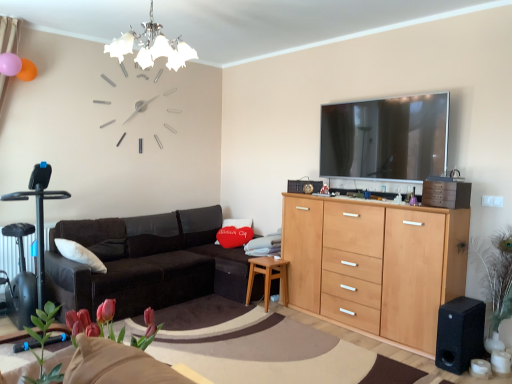
Question: Is black plastic swivel chair at left wider than light brown wooden side table at lower center?

Choices:
 (A) yes
 (B) no

Answer: (A)

Question: Is black plastic swivel chair at left oriented away from light brown wooden side table at lower center?

Choices:
 (A) no
 (B) yes

Answer: (A)

Question: Is black plastic swivel chair at left thinner than light brown wooden side table at lower center?

Choices:
 (A) no
 (B) yes

Answer: (A)

Question: Can you confirm if black plastic swivel chair at left is positioned to the left of light brown wooden side table at lower center?

Choices:
 (A) no
 (B) yes

Answer: (B)

Question: Is black plastic swivel chair at left located outside light brown wooden side table at lower center?

Choices:
 (A) yes
 (B) no

Answer: (A)

Question: Is chrome/textured glass chandelier at upper center wider or thinner than green leafy plant at right, placed as the 3th plant when sorted from front to back?

Choices:
 (A) thin
 (B) wide

Answer: (B)

Question: From the image's perspective, is chrome/textured glass chandelier at upper center above or below green leafy plant at right, the 1th plant when ordered from back to front?

Choices:
 (A) above
 (B) below

Answer: (A)

Question: Do you think chrome/textured glass chandelier at upper center is within green leafy plant at right, which ranks as the 1th plant in right-to-left order, or outside of it?

Choices:
 (A) outside
 (B) inside

Answer: (A)

Question: Is chrome/textured glass chandelier at upper center bigger or smaller than green leafy plant at right, which is the third plant from left to right?

Choices:
 (A) small
 (B) big

Answer: (B)

Question: Would you say black matte speaker at lower right is inside or outside green leafy plant at lower left, the third plant viewed from the right?

Choices:
 (A) outside
 (B) inside

Answer: (A)

Question: In terms of width, does black matte speaker at lower right look wider or thinner when compared to green leafy plant at lower left, which is counted as the 3th plant, starting from the back?

Choices:
 (A) wide
 (B) thin

Answer: (A)

Question: From the image's perspective, relative to green leafy plant at lower left, the third plant viewed from the right, is black matte speaker at lower right above or below?

Choices:
 (A) above
 (B) below

Answer: (B)

Question: In terms of height, does black matte speaker at lower right look taller or shorter compared to green leafy plant at lower left, arranged as the first plant when viewed from the front?

Choices:
 (A) short
 (B) tall

Answer: (B)

Question: From the image's perspective, is pink matte tulips at lower left, the 2th plant from the front, above or below green leafy plant at right, which is the third plant from left to right?

Choices:
 (A) below
 (B) above

Answer: (B)

Question: Is pink matte tulips at lower left, the second plant from the right, bigger or smaller than green leafy plant at right, which is the third plant from left to right?

Choices:
 (A) small
 (B) big

Answer: (A)